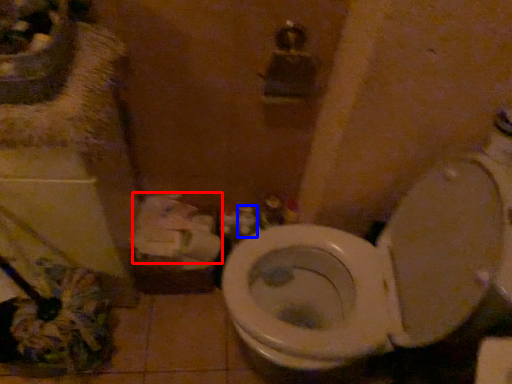
Question: Which object is further to the camera taking this photo, toilet paper (highlighted by a red box) or toiletry (highlighted by a blue box)?

Choices:
 (A) toilet paper
 (B) toiletry

Answer: (B)